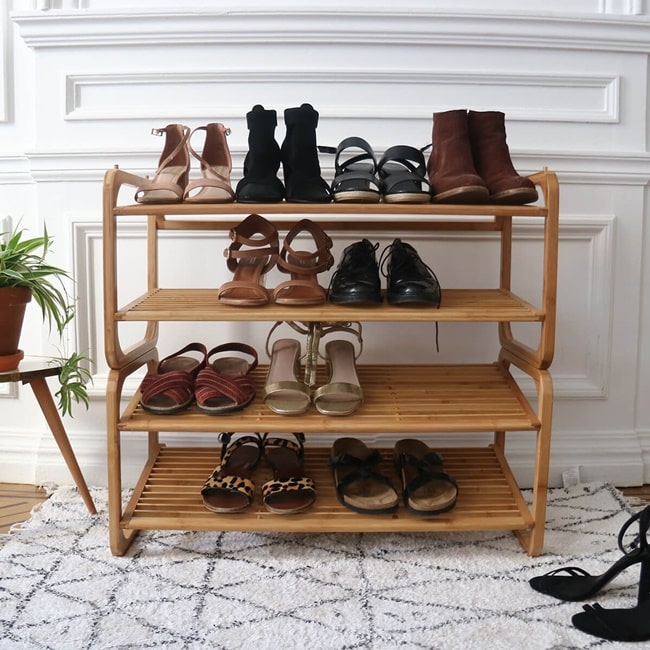
At what (x,y) coordinates should I click in order to perform the action: click on pairs of shoes. Please return your answer as a coordinate pair (x, y). The width and height of the screenshot is (650, 650). Looking at the image, I should click on (264, 482), (395, 488), (312, 378), (166, 387), (266, 287), (383, 278), (489, 179), (381, 161), (302, 162), (196, 177).